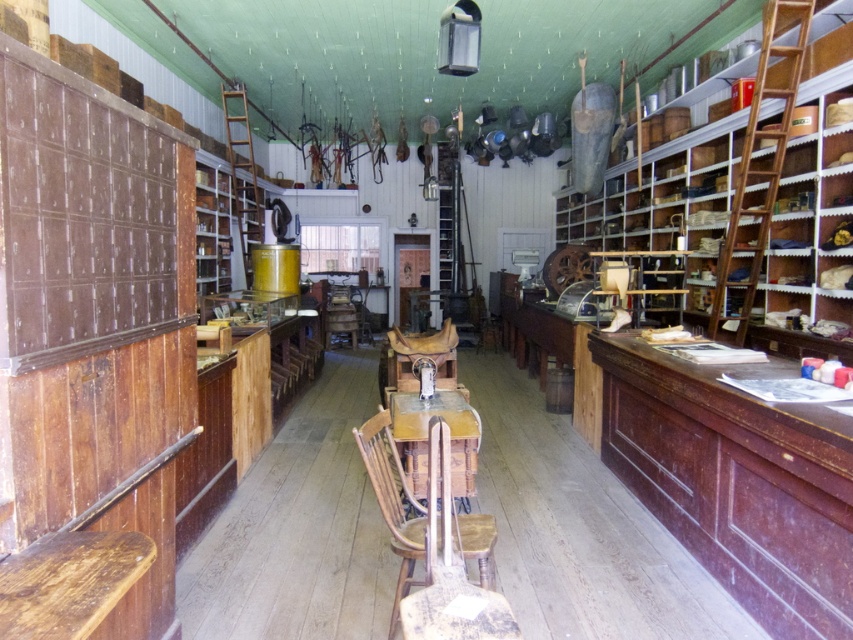
Which of these two, wooden chair at center or wooden table at center, stands shorter?

wooden table at center is shorter.

Is wooden chair at center further to the viewer compared to wooden table at center?

No, wooden chair at center is closer to the viewer.

Identify the location of wooden chair at center. This screenshot has height=640, width=853. (393, 502).

I want to click on wooden chair at center, so click(x=393, y=502).